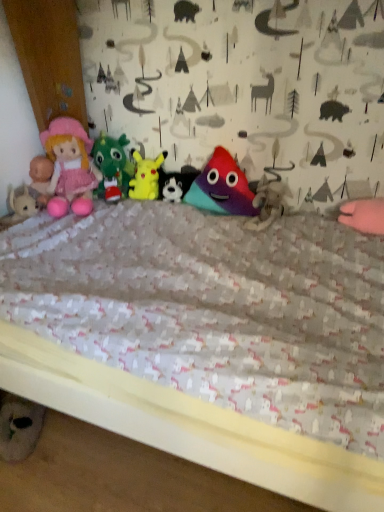
Question: From a real-world perspective, is multicolored plush triangle at center, the 2th toy positioned from the right, above or below multicolored fabric triangle at center, acting as the 1th toy starting from the right?

Choices:
 (A) above
 (B) below

Answer: (A)

Question: In terms of height, does multicolored plush triangle at center, the 2th toy positioned from the right, look taller or shorter compared to multicolored fabric triangle at center, which is counted as the fifth toy, starting from the left?

Choices:
 (A) tall
 (B) short

Answer: (A)

Question: Which of these objects is positioned closest to the matte plastic pyramid at center, arranged as the 3th toy when viewed from the right?

Choices:
 (A) yellow plush at center, which is the second toy in left-to-right order
 (B) pink plush doll at left
 (C) multicolored fabric triangle at center, acting as the 1th toy starting from the right
 (D) velvety green dragon at center, which is counted as the 5th toy, starting from the right
 (E) multicolored plush triangle at center, which appears as the 4th toy when viewed from the left

Answer: (A)

Question: Considering the real-world distances, which object is farthest from the matte plastic pyramid at center, arranged as the 3th toy when viewed from the right?

Choices:
 (A) yellow plush at center, which is the second toy in left-to-right order
 (B) pink plush doll at left
 (C) multicolored plush triangle at center, which appears as the 4th toy when viewed from the left
 (D) multicolored fabric triangle at center, which is counted as the fifth toy, starting from the left
 (E) velvety green dragon at center, which is counted as the 5th toy, starting from the right

Answer: (B)